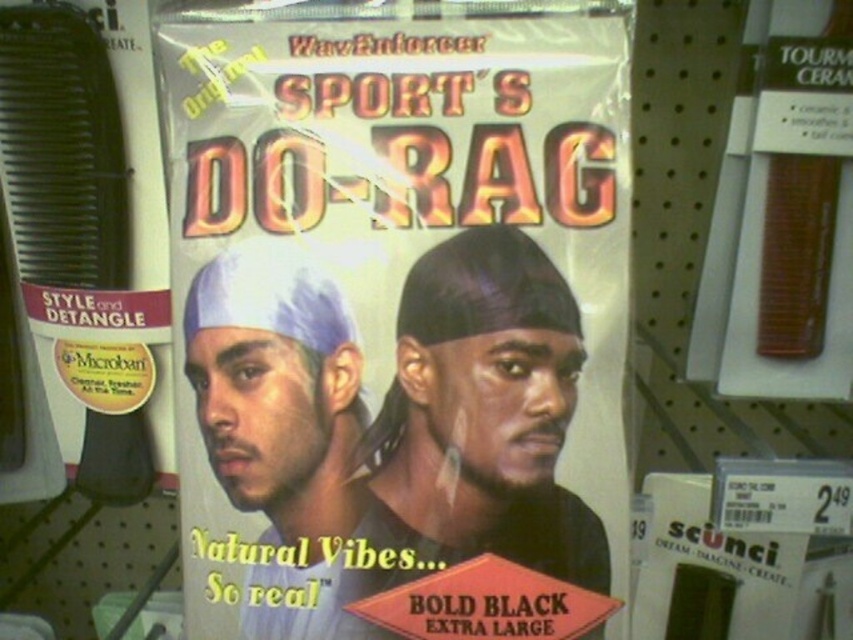
You are examining the packaging of the WaveEnforcer Sport. You notice two points marked on the packaging. The first point is at coordinates point (442, 476) and the second is at point (200, 362). Which of these points is closer to you?

Point (442, 476) is closer to the viewer than point (200, 362).